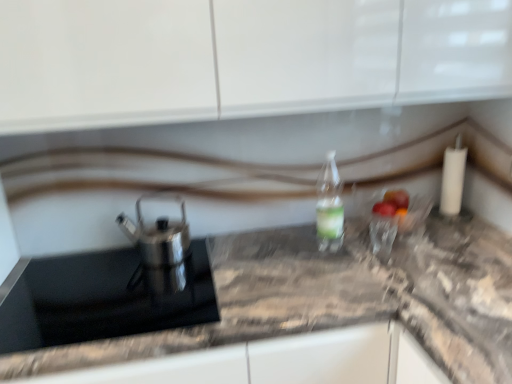
Identify the location of free space to the back side of clear plastic bottle at center. The width and height of the screenshot is (512, 384). (303, 234).